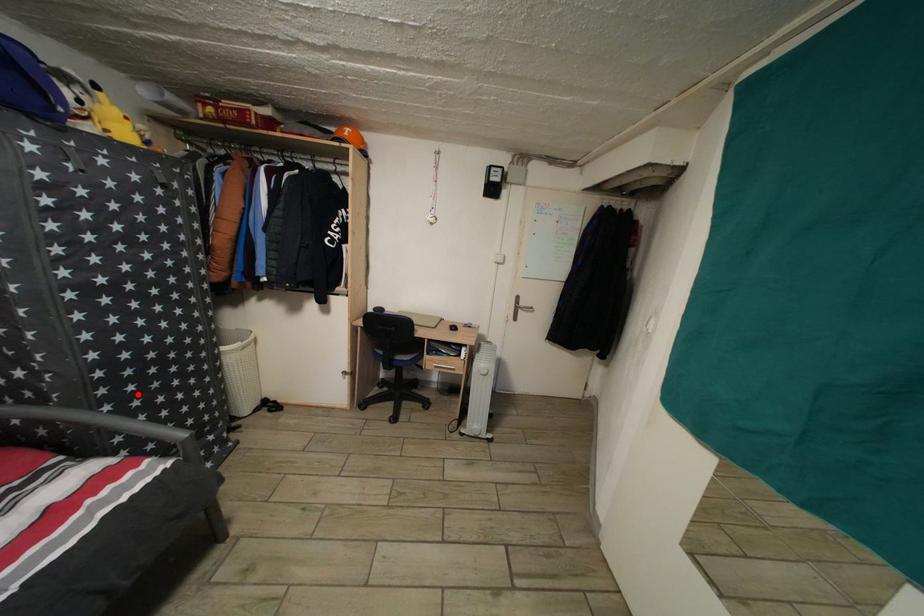
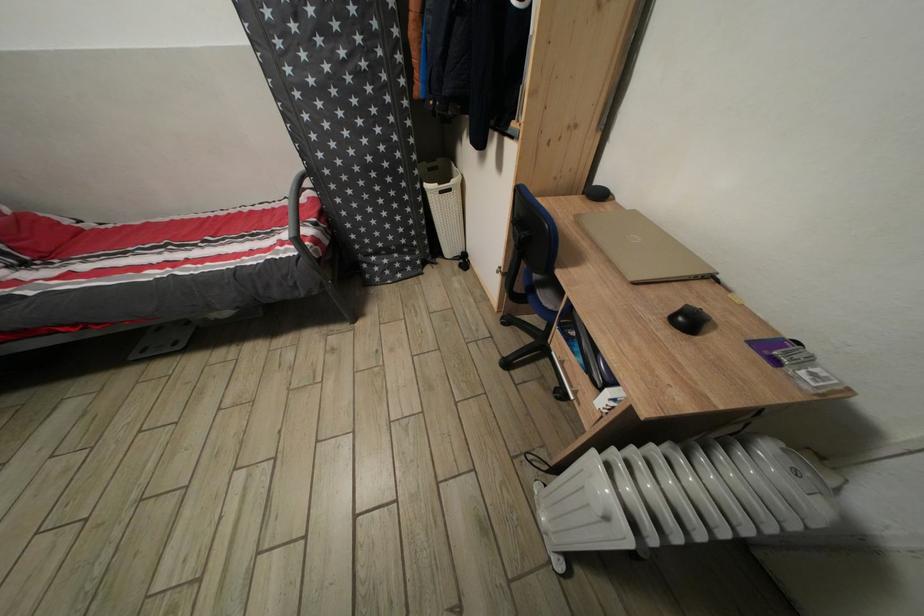
Question: I am providing you with two images of the same scene from different viewpoints. A red point is shown in image1. For the corresponding object point in image2, is it positioned nearer or farther from the camera?

Choices:
 (A) Nearer
 (B) Farther

Answer: (A)